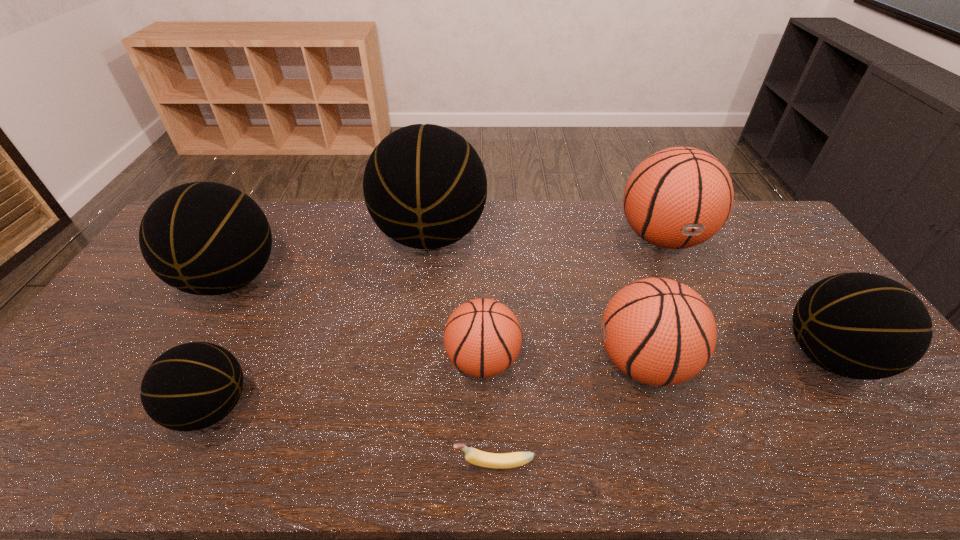
This screenshot has width=960, height=540. In the image, there is a desktop. In order to click on vacant space at the near edge in this screenshot , I will do `click(430, 443)`.

Where is `free region at the left edge`? Image resolution: width=960 pixels, height=540 pixels. free region at the left edge is located at coordinates (87, 352).

Where is `free space at the right edge`? free space at the right edge is located at coordinates (764, 255).

Find the location of a particular element. This screenshot has width=960, height=540. vacant area between the smallest black basketball and the leftmost orange basketball is located at coordinates (348, 384).

This screenshot has width=960, height=540. I want to click on empty location between the third smallest black basketball and the yellow banana, so click(363, 372).

Locate an element on the screen. This screenshot has width=960, height=540. vacant area between the second biggest black basketball and the third black basketball from left to right is located at coordinates (331, 258).

You are a GUI agent. You are given a task and a screenshot of the screen. Output one action in this format:
    pyautogui.click(x=<x>, y=<y>)
    Task: Click on the free area in between the second biggest orange basketball and the yellow banana
    This screenshot has height=540, width=960.
    Given the screenshot: What is the action you would take?
    pyautogui.click(x=568, y=413)

What are the coordinates of `free space between the tallest object and the smallest orange basketball` in the screenshot? It's located at (457, 298).

Locate an element on the screen. The height and width of the screenshot is (540, 960). empty space between the rightmost object and the second biggest black basketball is located at coordinates (530, 318).

Identify the location of free space between the smallest black basketball and the third biggest black basketball. pos(520,382).